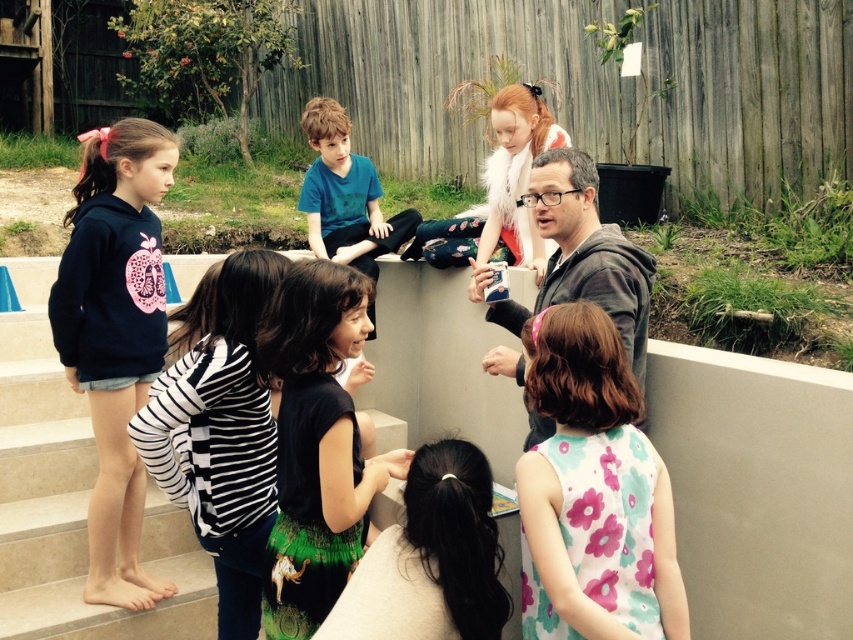
Based on the photo, does fluffy white fur at upper center appear on the right side of blue cotton shirt at center?

Indeed, fluffy white fur at upper center is positioned on the right side of blue cotton shirt at center.

From the picture: Is fluffy white fur at upper center thinner than blue cotton shirt at center?

In fact, fluffy white fur at upper center might be wider than blue cotton shirt at center.

Locate an element on the screen. The width and height of the screenshot is (853, 640). fluffy white fur at upper center is located at coordinates (498, 193).

Can you confirm if floral sleeveless dress at lower right is positioned below black striped shirt at lower left?

Incorrect, floral sleeveless dress at lower right is not positioned below black striped shirt at lower left.

Which of these two, floral sleeveless dress at lower right or black striped shirt at lower left, stands taller?

black striped shirt at lower left

Is point (583, 520) closer to camera compared to point (166, 460)?

Yes, point (583, 520) is closer to viewer.

Identify the location of floral sleeveless dress at lower right. This screenshot has width=853, height=640. (593, 492).

Between floral sleeveless dress at lower right and dark blue hoodie at left, which one appears on the right side from the viewer's perspective?

floral sleeveless dress at lower right

Between point (611, 573) and point (111, 316), which one is positioned in front?

Point (611, 573) is more forward.

This screenshot has height=640, width=853. Identify the location of floral sleeveless dress at lower right. (593, 492).